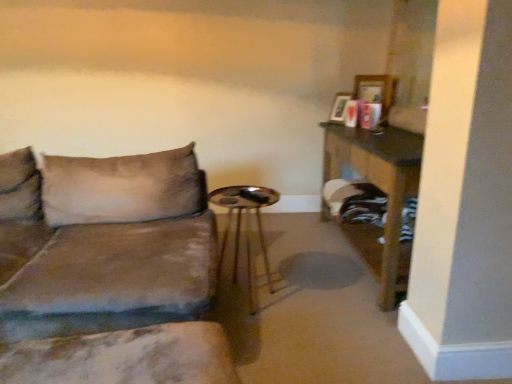
Question: Is marble-patterned cushion at lower left turned away from velvet brown couch at left?

Choices:
 (A) yes
 (B) no

Answer: (A)

Question: Can you confirm if marble-patterned cushion at lower left is wider than velvet brown couch at left?

Choices:
 (A) no
 (B) yes

Answer: (A)

Question: From a real-world perspective, is marble-patterned cushion at lower left on velvet brown couch at left?

Choices:
 (A) yes
 (B) no

Answer: (B)

Question: Can you confirm if marble-patterned cushion at lower left is smaller than velvet brown couch at left?

Choices:
 (A) no
 (B) yes

Answer: (B)

Question: Considering the relative sizes of marble-patterned cushion at lower left and velvet brown couch at left in the image provided, is marble-patterned cushion at lower left thinner than velvet brown couch at left?

Choices:
 (A) no
 (B) yes

Answer: (B)

Question: Considering the relative sizes of marble-patterned cushion at lower left and velvet brown couch at left in the image provided, is marble-patterned cushion at lower left taller than velvet brown couch at left?

Choices:
 (A) no
 (B) yes

Answer: (A)

Question: Is wooden table at right to the left of metallic gold side table at center from the viewer's perspective?

Choices:
 (A) no
 (B) yes

Answer: (A)

Question: Considering the relative positions of wooden table at right and metallic gold side table at center in the image provided, is wooden table at right in front of metallic gold side table at center?

Choices:
 (A) no
 (B) yes

Answer: (B)

Question: From the image's perspective, would you say wooden table at right is positioned over metallic gold side table at center?

Choices:
 (A) no
 (B) yes

Answer: (B)

Question: From a real-world perspective, is wooden table at right on metallic gold side table at center?

Choices:
 (A) no
 (B) yes

Answer: (B)

Question: Does wooden table at right contain metallic gold side table at center?

Choices:
 (A) yes
 (B) no

Answer: (B)

Question: Are wooden table at right and metallic gold side table at center far apart?

Choices:
 (A) yes
 (B) no

Answer: (B)

Question: From the image's perspective, is velvet brown couch at left below marble-patterned cushion at lower left?

Choices:
 (A) yes
 (B) no

Answer: (B)